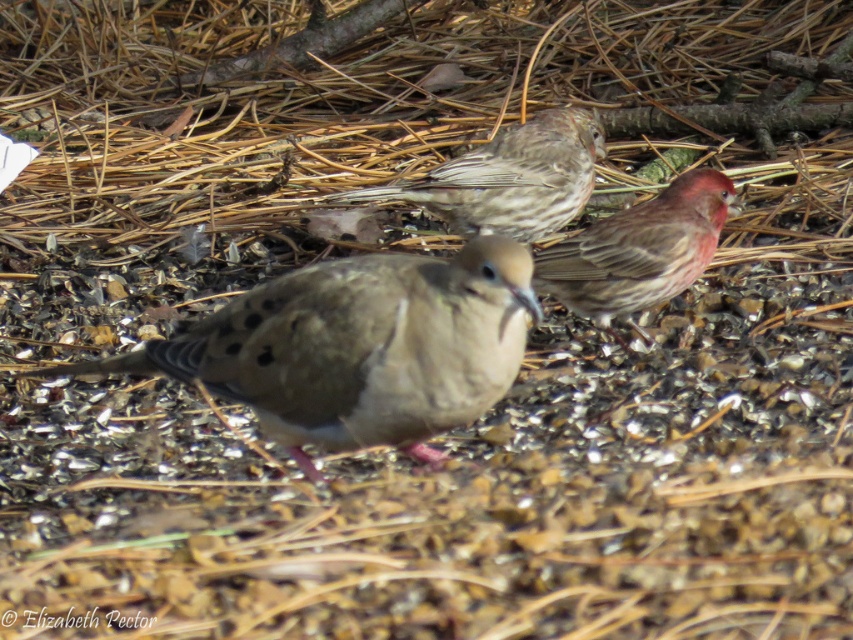
Does brown speckled pigeon at center have a larger size compared to brown speckled sparrow at right?

Yes, brown speckled pigeon at center is bigger than brown speckled sparrow at right.

Which is above, brown speckled pigeon at center or brown speckled sparrow at right?

Positioned higher is brown speckled sparrow at right.

Is point (347, 365) behind point (659, 232)?

No, (347, 365) is closer to viewer.

I want to click on brown speckled pigeon at center, so click(358, 348).

Based on the photo, does brown speckled pigeon at center appear under brown speckled sparrow at upper center?

Indeed, brown speckled pigeon at center is positioned under brown speckled sparrow at upper center.

Who is positioned more to the right, brown speckled pigeon at center or brown speckled sparrow at upper center?

brown speckled sparrow at upper center is more to the right.

The height and width of the screenshot is (640, 853). I want to click on brown speckled pigeon at center, so click(x=358, y=348).

This screenshot has width=853, height=640. Identify the location of brown speckled pigeon at center. (358, 348).

Between brown speckled sparrow at right and brown speckled sparrow at upper center, which one is positioned lower?

brown speckled sparrow at right is below.

Can you confirm if brown speckled sparrow at right is positioned below brown speckled sparrow at upper center?

Yes, brown speckled sparrow at right is below brown speckled sparrow at upper center.

Does point (654, 300) come in front of point (563, 115)?

Yes, it is.

Where is `brown speckled sparrow at right`? Image resolution: width=853 pixels, height=640 pixels. brown speckled sparrow at right is located at coordinates (639, 250).